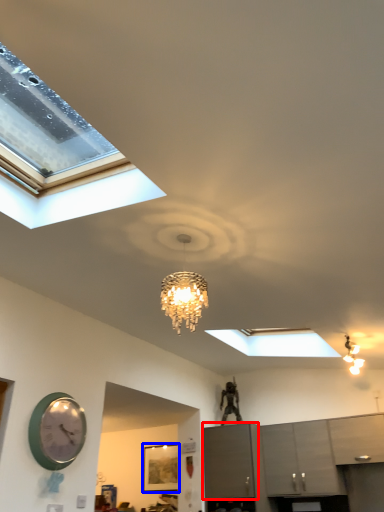
Question: Among these objects, which one is nearest to the camera, cabinetry (highlighted by a red box) or picture frame (highlighted by a blue box)?

Choices:
 (A) cabinetry
 (B) picture frame

Answer: (A)